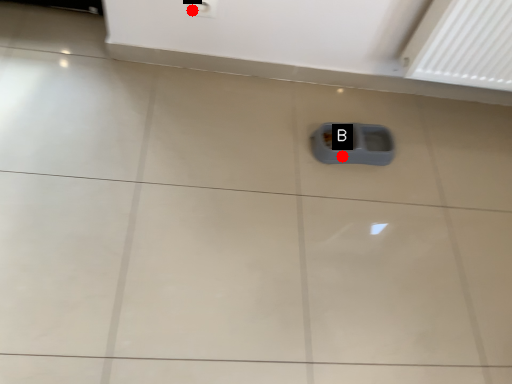
Question: Two points are circled on the image, labeled by A and B beside each circle. Which point appears closest to the camera in this image?

Choices:
 (A) A is closer
 (B) B is closer

Answer: (A)